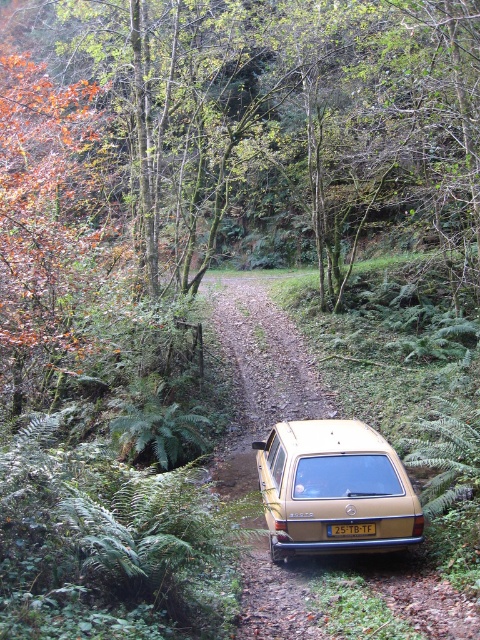
You are a passenger in the gold matte station wagon at center and want to point out the brown leafy tree at upper left to the driver. Which direction should you tell the driver to look?

The brown leafy tree at upper left is on the left side of the gold matte station wagon at center, so you should tell the driver to look to the left.

You are a photographer trying to capture the gold matte station wagon at center and the yellow plastic license plate at center in a single shot. Since the camera can only focus on one object at a time, which object should you focus on to ensure the other remains in the background?

The gold matte station wagon at center has a greater height compared to the yellow plastic license plate at center, so focusing on the taller gold matte station wagon at center will keep the smaller yellow plastic license plate at center in the background.

You are a delivery person who needs to attach a GPS tracker to the gold matte station wagon at center. The GPS tracker must be placed exactly 3 feet away from the yellow plastic license plate at center. Based on the scene description, can you determine if the GPS tracker can be placed on the station wagon without exceeding the vehicle?

The gold matte station wagon at center and yellow plastic license plate at center are 3.32 feet apart. Since the GPS tracker needs to be placed exactly 3 feet away from the license plate, it can be placed on the station wagon as the distance is within the required range and does not exceed the vehicle.